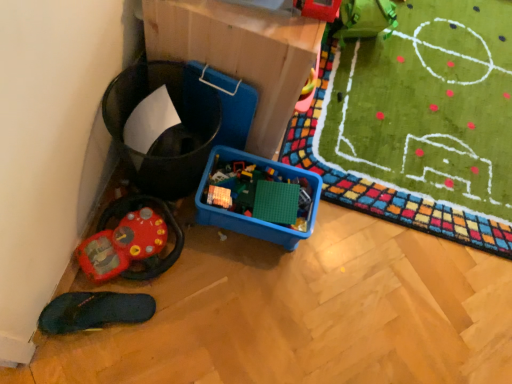
Identify the location of free location in front of rubberized plastic toy at upper right, which is the 1th toy in right-to-left order. The image size is (512, 384). (291, 37).